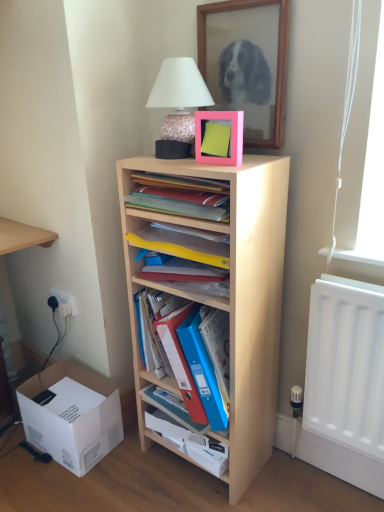
Find the location of a particular element. This screenshot has width=384, height=512. vacant space to the left of light wood shelf at center, acting as the 3th shelf starting from the top is located at coordinates (129, 475).